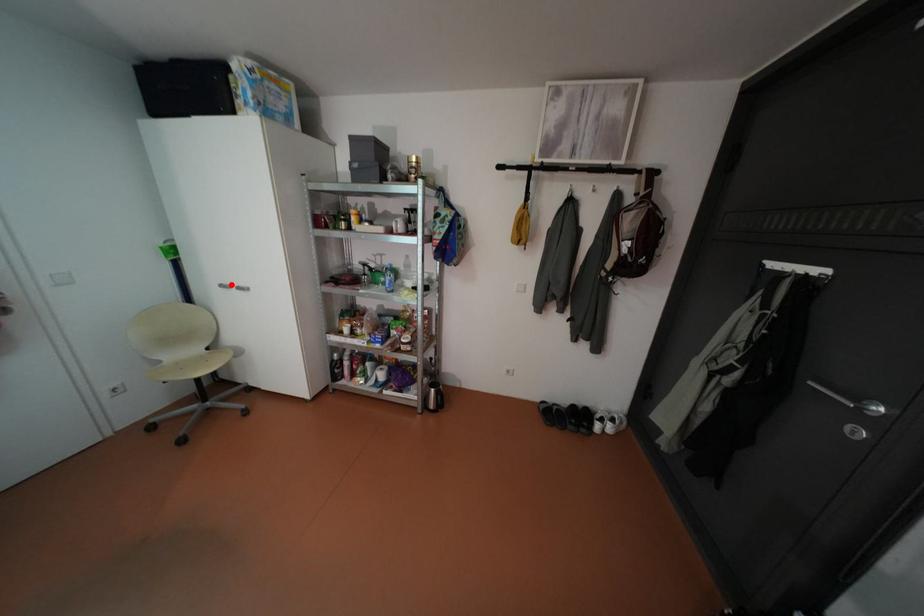
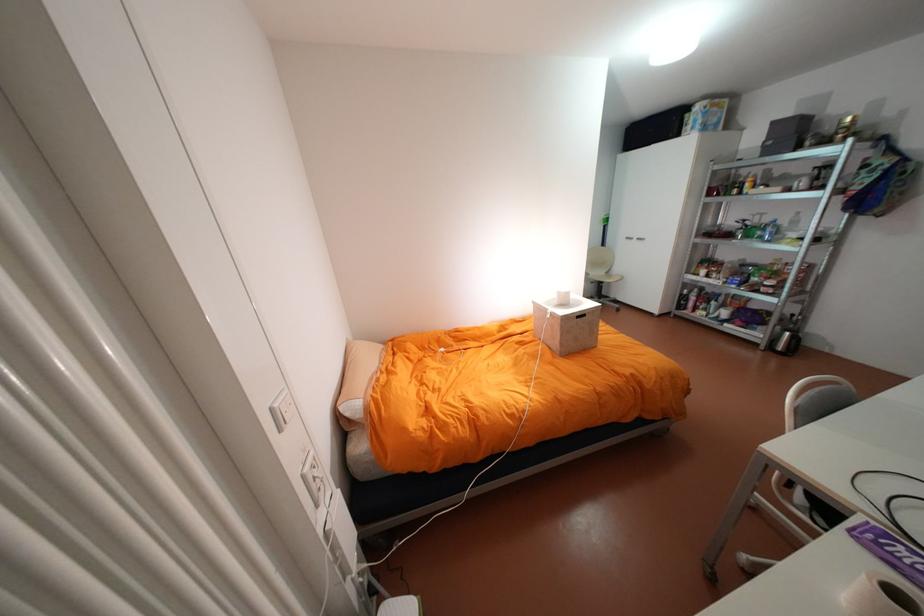
Find the pixel in the second image that matches the highlighted location in the first image.

(636, 237)